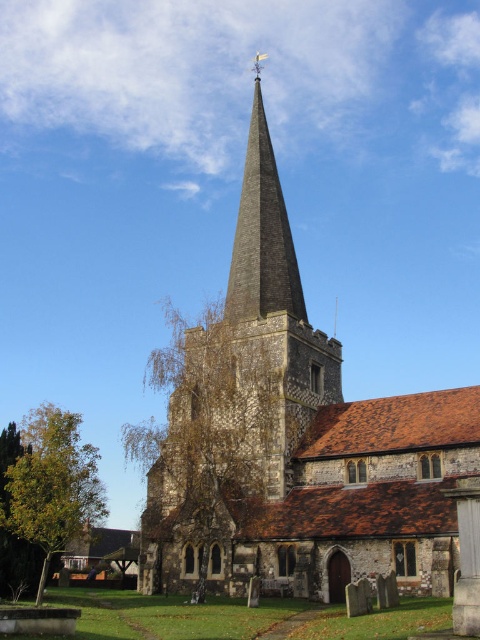
Question: Does stone steeple at center appear on the left side of dark gray stone spire at center?

Choices:
 (A) no
 (B) yes

Answer: (B)

Question: Does stone steeple at center appear over dark gray stone spire at center?

Choices:
 (A) no
 (B) yes

Answer: (A)

Question: Observing the image, what is the correct spatial positioning of stone steeple at center in reference to dark gray stone spire at center?

Choices:
 (A) right
 (B) left

Answer: (B)